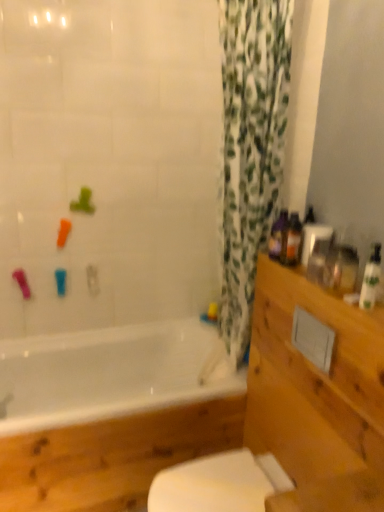
Where is `green leafy fabric at center`? green leafy fabric at center is located at coordinates (250, 148).

Measure the distance between point (266, 97) and camera.

1.60 meters.

Where is `white glossy bottle at right, the third toiletry in the left-to-right sequence`? This screenshot has width=384, height=512. white glossy bottle at right, the third toiletry in the left-to-right sequence is located at coordinates (371, 279).

Describe the element at coordinates (314, 381) in the screenshot. This screenshot has width=384, height=512. I see `wooden drawer at right` at that location.

You are a GUI agent. You are given a task and a screenshot of the screen. Output one action in this format:
    pyautogui.click(x=<x>, y=<y>)
    Task: Click on the green leafy fabric at center
    
    Given the screenshot: What is the action you would take?
    pyautogui.click(x=250, y=148)

Considering the sizes of objects translucent plastic bottle at right, which is the 3th toiletry from right to left, and white glossy bottle at right, the third toiletry in the left-to-right sequence, in the image provided, who is thinner, translucent plastic bottle at right, which is the 3th toiletry from right to left, or white glossy bottle at right, the third toiletry in the left-to-right sequence,?

With smaller width is white glossy bottle at right, the third toiletry in the left-to-right sequence.

Are translucent plastic bottle at right, which appears as the 3th toiletry when viewed from the front, and white glossy bottle at right, the first toiletry viewed from the right, far apart?

No, translucent plastic bottle at right, which appears as the 3th toiletry when viewed from the front, is not far away from white glossy bottle at right, the first toiletry viewed from the right.

Is translucent plastic bottle at right, which appears as the 3th toiletry when viewed from the front, situated inside white glossy bottle at right, the third toiletry in the left-to-right sequence, or outside?

translucent plastic bottle at right, which appears as the 3th toiletry when viewed from the front, cannot be found inside white glossy bottle at right, the third toiletry in the left-to-right sequence.

From a real-world perspective, which is physically above, translucent plastic bottle at right, which is the 3th toiletry from right to left, or white glossy bottle at right, the 3th toiletry viewed from the back?

translucent plastic bottle at right, which is the 3th toiletry from right to left.

Where is `toilet below the green leafy fabric at center (from a real-world perspective)`? This screenshot has height=512, width=384. toilet below the green leafy fabric at center (from a real-world perspective) is located at coordinates (219, 484).

From the picture: Choose the correct answer: Is white glossy toilet at lower center inside green leafy fabric at center or outside it?

white glossy toilet at lower center is spatially situated outside green leafy fabric at center.

Can you confirm if white glossy toilet at lower center is shorter than green leafy fabric at center?

Yes, white glossy toilet at lower center is shorter than green leafy fabric at center.

Which object is positioned more to the right, white glossy toilet at lower center or green leafy fabric at center?

green leafy fabric at center is more to the right.

How much distance is there between white glossy bathtub at lower left and white glossy toilet at lower center?

They are 14.59 inches apart.

From the image's perspective, would you say white glossy bathtub at lower left is positioned over white glossy toilet at lower center?

Yes.

Identify the location of toilet that appears on the right of white glossy bathtub at lower left. This screenshot has height=512, width=384. (219, 484).

Does white glossy bathtub at lower left have a larger size compared to white glossy toilet at lower center?

Correct, white glossy bathtub at lower left is larger in size than white glossy toilet at lower center.

Is wooden drawer at right not inside translucent plastic bottles at upper right, the 2th toiletry when ordered from back to front?

Indeed, wooden drawer at right is completely outside translucent plastic bottles at upper right, the 2th toiletry when ordered from back to front.

Is wooden drawer at right to the right of translucent plastic bottles at upper right, placed as the second toiletry when sorted from left to right, from the viewer's perspective?

Indeed, wooden drawer at right is positioned on the right side of translucent plastic bottles at upper right, placed as the second toiletry when sorted from left to right.

How distant is wooden drawer at right from translucent plastic bottles at upper right, which appears as the second toiletry when viewed from the front?

A distance of 15.97 inches exists between wooden drawer at right and translucent plastic bottles at upper right, which appears as the second toiletry when viewed from the front.

From the image's perspective, would you say wooden drawer at right is shown under translucent plastic bottles at upper right, the second toiletry viewed from the right?

Indeed, from the image's perspective, wooden drawer at right is shown beneath translucent plastic bottles at upper right, the second toiletry viewed from the right.

Does wooden drawer at right have a lesser height compared to green leafy fabric at center?

Correct, wooden drawer at right is not as tall as green leafy fabric at center.

Which object is further away from the camera, wooden drawer at right or green leafy fabric at center?

green leafy fabric at center is more distant.

Would you say wooden drawer at right is to the left or to the right of green leafy fabric at center in the picture?

wooden drawer at right is to the right of green leafy fabric at center.

Is wooden drawer at right facing away from green leafy fabric at center?

No.

Where is `the 3rd toiletry positioned above the green leafy fabric at center (from a real-world perspective)`? The image size is (384, 512). the 3rd toiletry positioned above the green leafy fabric at center (from a real-world perspective) is located at coordinates (291, 241).

Is translucent plastic bottles at upper right, which appears as the second toiletry when viewed from the front, bigger than green leafy fabric at center?

Incorrect, translucent plastic bottles at upper right, which appears as the second toiletry when viewed from the front, is not larger than green leafy fabric at center.

From the picture: Considering the relative positions of translucent plastic bottles at upper right, the second toiletry viewed from the right, and green leafy fabric at center in the image provided, is translucent plastic bottles at upper right, the second toiletry viewed from the right, to the left or to the right of green leafy fabric at center?

Clearly, translucent plastic bottles at upper right, the second toiletry viewed from the right, is on the right of green leafy fabric at center in the image.

Consider the image. From a real-world perspective, which object rests below the other?

wooden drawer at right, from a real-world perspective.

Looking at this image, considering the relative sizes of wooden drawer at right and white glossy bottle at right, the first toiletry viewed from the front, in the image provided, is wooden drawer at right taller than white glossy bottle at right, the first toiletry viewed from the front,?

Indeed, wooden drawer at right has a greater height compared to white glossy bottle at right, the first toiletry viewed from the front.

Locate an element on the screen. This screenshot has height=512, width=384. the 1st toiletry positioned above the wooden drawer at right (from the image's perspective) is located at coordinates (371, 279).

Is wooden drawer at right surrounding white glossy bottle at right, the first toiletry viewed from the front?

Actually, white glossy bottle at right, the first toiletry viewed from the front, is outside wooden drawer at right.

Locate an element on the screen. The height and width of the screenshot is (512, 384). toiletry that appears below the translucent plastic bottle at right, which is the 3th toiletry from right to left (from a real-world perspective) is located at coordinates (371, 279).

Where is `curtain that appears on the right of white glossy toilet at lower center`? curtain that appears on the right of white glossy toilet at lower center is located at coordinates (250, 148).

From the image, which object appears to be nearer to translucent plastic bottle at right, which appears as the 3th toiletry when viewed from the front, green leafy fabric at center or white glossy bathtub at lower left?

Among the two, green leafy fabric at center is located nearer to translucent plastic bottle at right, which appears as the 3th toiletry when viewed from the front.

Looking at the image, which one is located closer to translucent plastic bottles at upper right, which appears as the second toiletry when viewed from the front, green leafy fabric at center or translucent plastic bottle at right, placed as the 1th toiletry when sorted from back to front?

translucent plastic bottle at right, placed as the 1th toiletry when sorted from back to front, lies closer to translucent plastic bottles at upper right, which appears as the second toiletry when viewed from the front, than the other object.

Considering their positions, is green leafy fabric at center positioned closer to translucent plastic bottles at upper right, the 2th toiletry when ordered from back to front, than white glossy bathtub at lower left?

green leafy fabric at center lies closer to translucent plastic bottles at upper right, the 2th toiletry when ordered from back to front, than the other object.

Estimate the real-world distances between objects in this image. Which object is further from white glossy bathtub at lower left, translucent plastic bottles at upper right, the second toiletry viewed from the right, or white glossy toilet at lower center?

translucent plastic bottles at upper right, the second toiletry viewed from the right.

From the image, which object appears to be farther from white glossy bottle at right, the third toiletry in the left-to-right sequence, translucent plastic bottles at upper right, the second toiletry viewed from the right, or white glossy toilet at lower center?

white glossy toilet at lower center.

Which object lies further to the anchor point translucent plastic bottle at right, which is the 1th toiletry in left-to-right order, translucent plastic bottles at upper right, the 2th toiletry when ordered from back to front, or white glossy toilet at lower center?

Among the two, white glossy toilet at lower center is located further to translucent plastic bottle at right, which is the 1th toiletry in left-to-right order.

From the image, which object appears to be nearer to wooden drawer at right, white glossy bottle at right, the first toiletry viewed from the front, or white glossy toilet at lower center?

white glossy toilet at lower center is positioned closer to the anchor wooden drawer at right.

Looking at the image, which one is located closer to white glossy bathtub at lower left, wooden drawer at right or translucent plastic bottle at right, which is the 3th toiletry from right to left?

wooden drawer at right.

The width and height of the screenshot is (384, 512). Find the location of `drawer between translucent plastic bottle at right, which is the 3th toiletry from right to left, and white glossy toilet at lower center from top to bottom`. drawer between translucent plastic bottle at right, which is the 3th toiletry from right to left, and white glossy toilet at lower center from top to bottom is located at coordinates (314, 381).

Find the location of a particular element. toiletry that lies between translucent plastic bottles at upper right, which appears as the second toiletry when viewed from the front, and white glossy toilet at lower center from top to bottom is located at coordinates (371, 279).

I want to click on drawer that lies between translucent plastic bottles at upper right, which appears as the second toiletry when viewed from the front, and white glossy bathtub at lower left from top to bottom, so click(x=314, y=381).

At what (x,y) coordinates should I click in order to perform the action: click on toiletry located between white glossy bottle at right, the first toiletry viewed from the front, and translucent plastic bottle at right, which is the 1th toiletry in left-to-right order, in the depth direction. Please return your answer as a coordinate pair (x, y). The width and height of the screenshot is (384, 512). Looking at the image, I should click on (291, 241).